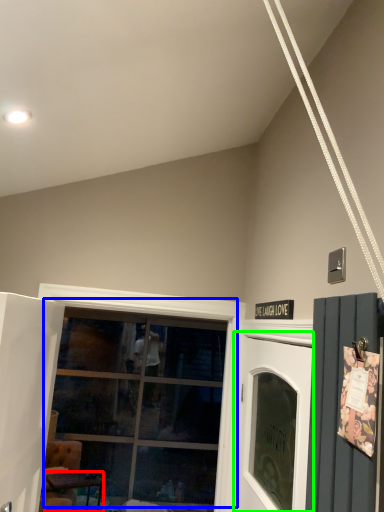
Question: Based on their relative distances, which object is farther from table (highlighted by a red box)? Choose from window (highlighted by a blue box) and garage door (highlighted by a green box).

Choices:
 (A) window
 (B) garage door

Answer: (B)